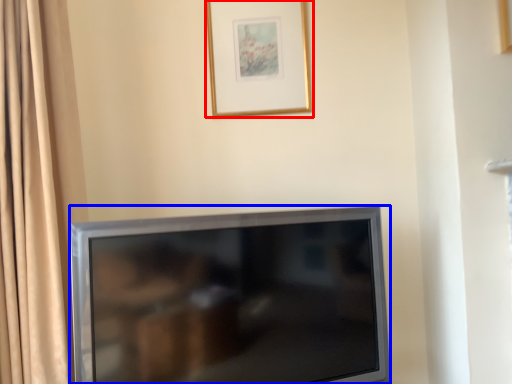
Question: Which point is closer to the camera, picture frame (highlighted by a red box) or television (highlighted by a blue box)?

Choices:
 (A) picture frame
 (B) television

Answer: (B)